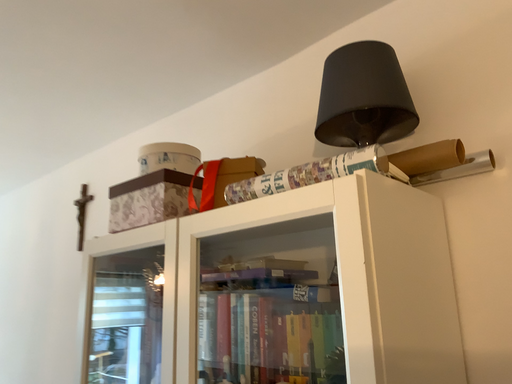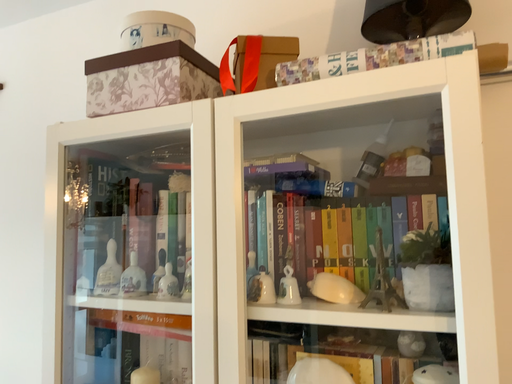
Question: How did the camera likely rotate when shooting the video?

Choices:
 (A) rotated left
 (B) rotated right

Answer: (B)